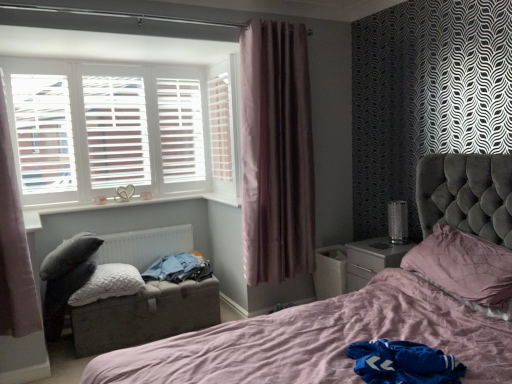
At what (x,y) coordinates should I click in order to perform the action: click on vacant area on top of white metallic radiator at lower left (from a real-world perspective). Please return your answer as a coordinate pair (x, y). The height and width of the screenshot is (384, 512). Looking at the image, I should click on (145, 229).